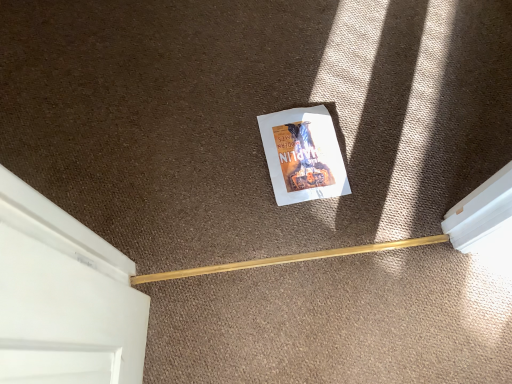
Locate an element on the screen. vacant area located to the right-hand side of matte paper book at center is located at coordinates (382, 149).